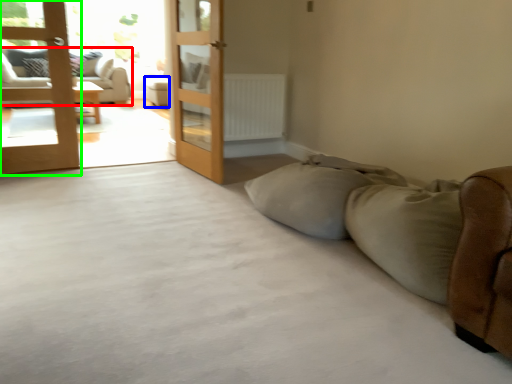
Question: Considering the real-world distances, which object is closest to studio couch (highlighted by a red box)? furniture (highlighted by a blue box) or door (highlighted by a green box).

Choices:
 (A) furniture
 (B) door

Answer: (A)